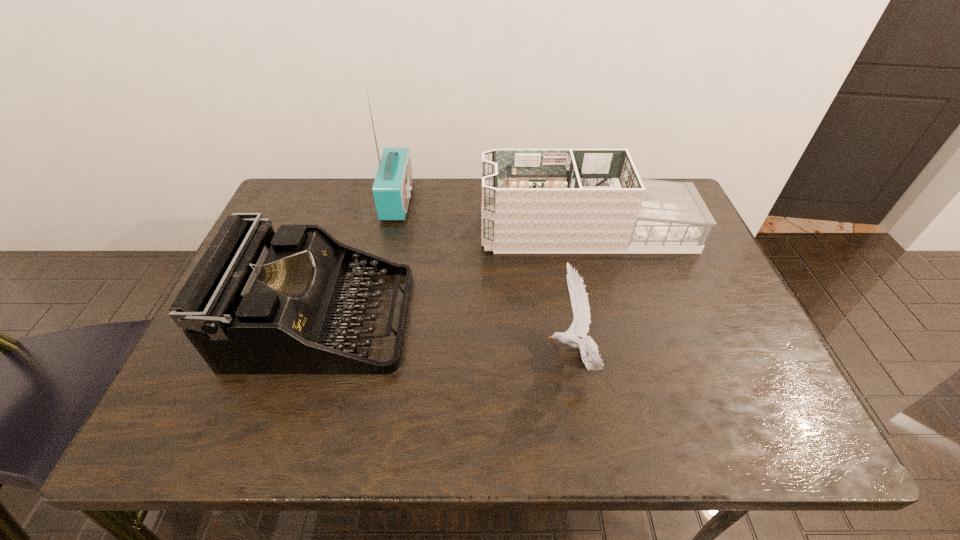
This screenshot has height=540, width=960. I want to click on the tallest object, so click(392, 186).

This screenshot has height=540, width=960. I want to click on dollhouse, so click(x=533, y=200).

Find the location of a particular element. The width and height of the screenshot is (960, 540). typewriter is located at coordinates point(258,302).

Where is `the shortest object`? the shortest object is located at coordinates (588, 348).

What are the coordinates of `free spot located on the front panel of the tallest object` in the screenshot? It's located at (458, 200).

Identify the location of free spot located 0.370m at the entrance of the dollhouse. (351, 231).

Locate an element on the screen. The width and height of the screenshot is (960, 540). free spot located 0.230m at the entrance of the dollhouse is located at coordinates (400, 231).

This screenshot has width=960, height=540. What are the coordinates of `vacant space positioned 0.130m at the entrance of the dollhouse` in the screenshot? It's located at (436, 231).

You are a GUI agent. You are given a task and a screenshot of the screen. Output one action in this format:
    pyautogui.click(x=<x>, y=<y>)
    Task: Click on the vacant space located 0.300m on the typing side of the typewriter
    The height and width of the screenshot is (540, 960).
    Given the screenshot: What is the action you would take?
    pyautogui.click(x=535, y=320)

Identify the location of vacant area located 0.270m at the tip of the beak of the shortest object. (422, 354).